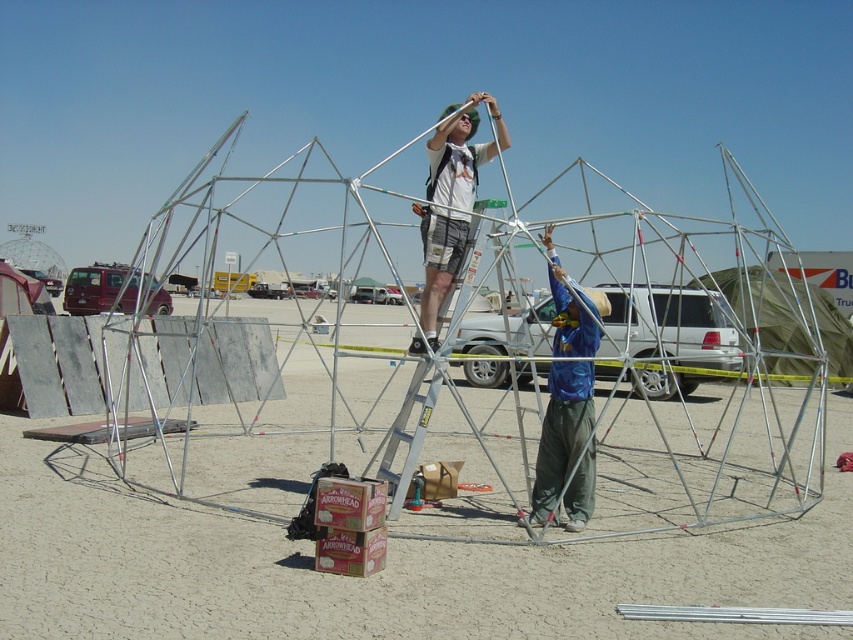
You are a photographer at the desert event. You need to capture a photo of the matte white shirt at center without the silver metallic ladder at center blocking it. How should you position yourself to ensure the ladder isn work?

The matte white shirt at center is positioned on the right side of the silver metallic ladder at center. To avoid the ladder blocking the shirt, you should move to the left side of the ladder so that the shirt is visible to the right while the ladder is out of frame.

You are a safety inspector checking the distance between the matte white shirt at center and the silver metallic ladder at center. According to safety regulations, the minimum distance required between a worker and the ladder must be at least 1 meter. Is the current distance compliant with the safety regulations?

The matte white shirt at center and silver metallic ladder at center are 74.64 centimeters apart, which is less than the required 1 meter. Therefore, the current distance does not comply with safety regulations.